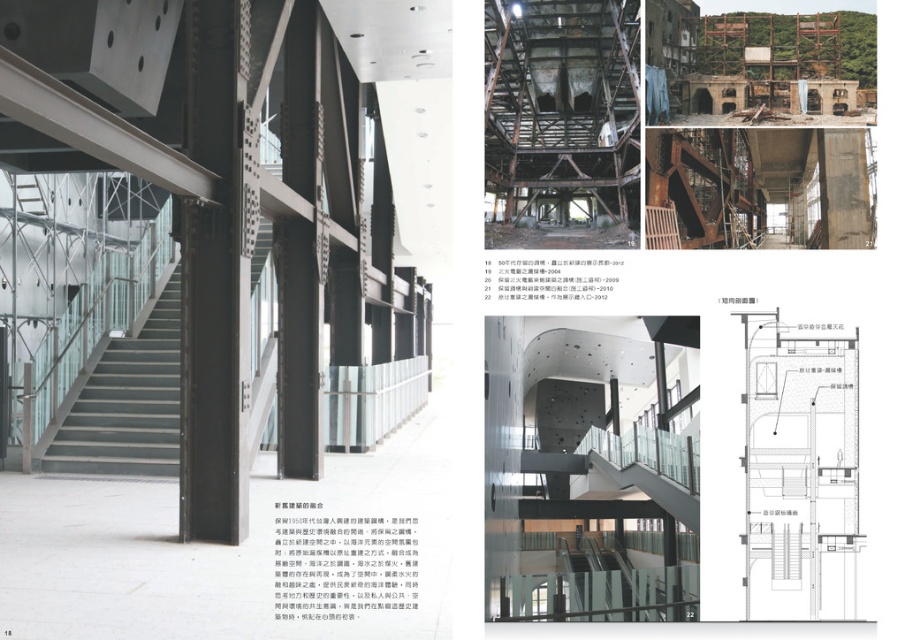
Question: Can you confirm if matte gray staircase at center is positioned above transparent glass stairs at center?

Choices:
 (A) yes
 (B) no

Answer: (A)

Question: Which of the following is the farthest from the observer?

Choices:
 (A) transparent glass stairs at center
 (B) matte gray staircase at center

Answer: (B)

Question: Is the position of matte gray staircase at center less distant than that of transparent glass stairs at center?

Choices:
 (A) yes
 (B) no

Answer: (B)

Question: Is matte gray staircase at center bigger than transparent glass stairs at center?

Choices:
 (A) yes
 (B) no

Answer: (B)

Question: Which point is farther to the camera?

Choices:
 (A) transparent glass stairs at center
 (B) matte gray staircase at center

Answer: (B)